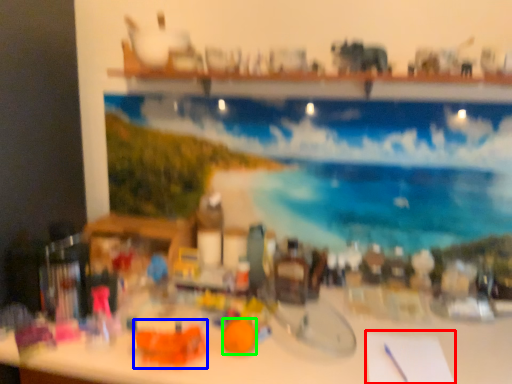
Question: Considering the real-world distances, which object is closest to notepad (highlighted by a red box)? toy (highlighted by a blue box) or toy (highlighted by a green box).

Choices:
 (A) toy
 (B) toy

Answer: (B)